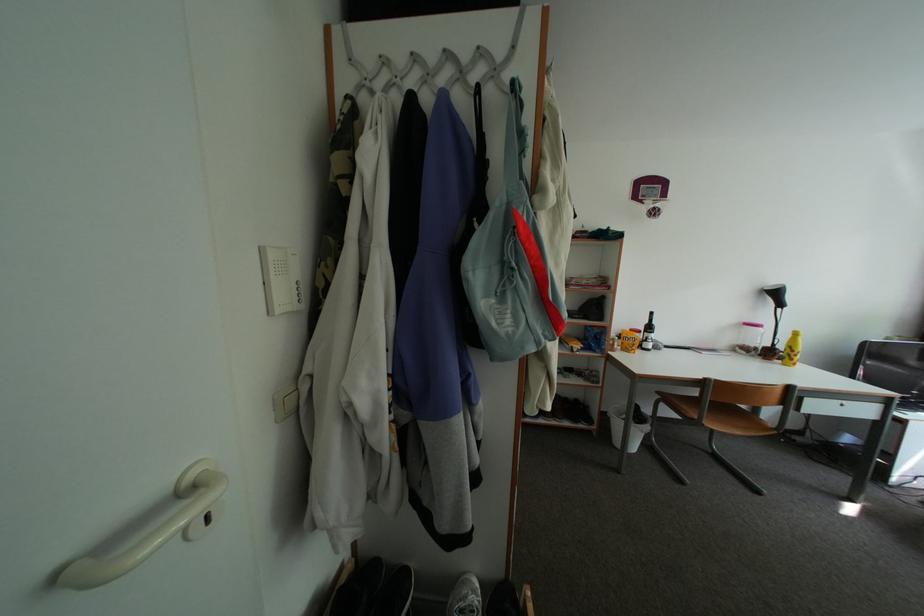
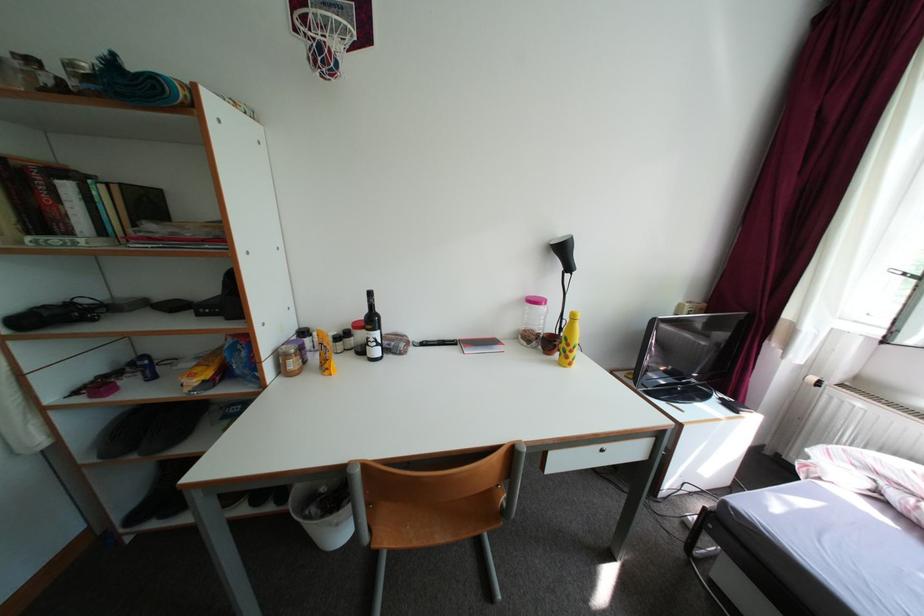
In a continuous first-person perspective shot, in which direction is the camera moving?

The movement direction of the cameraman is right, forward.